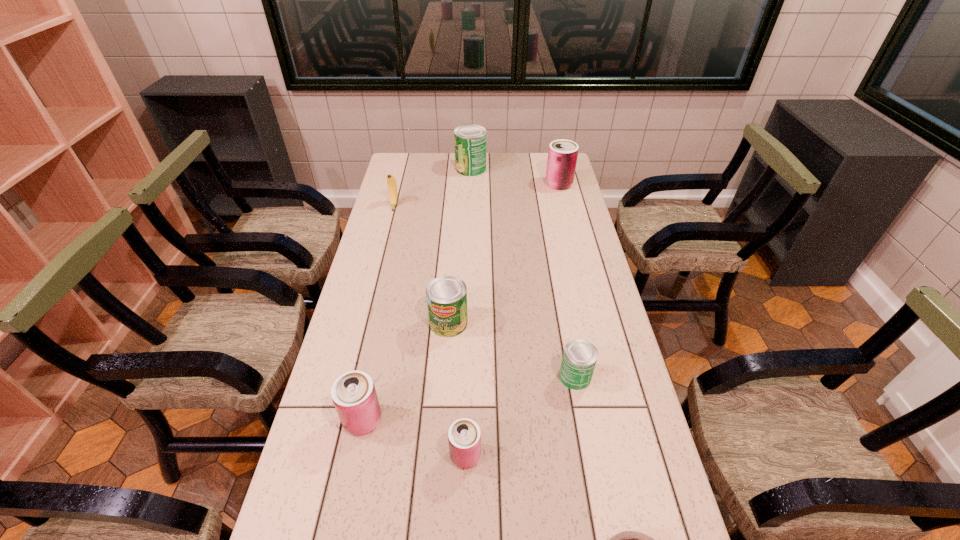
The height and width of the screenshot is (540, 960). In order to click on banana that is at the left edge in this screenshot , I will do `click(391, 181)`.

This screenshot has width=960, height=540. Identify the location of can located at the left edge. (353, 393).

The image size is (960, 540). Find the location of `object that is at the far right corner`. object that is at the far right corner is located at coordinates (562, 155).

Where is `blank area at the far edge`? This screenshot has height=540, width=960. blank area at the far edge is located at coordinates (525, 154).

Find the location of a particular element. This screenshot has height=540, width=960. free space at the left edge of the desktop is located at coordinates (399, 305).

In the image, there is a desktop. Where is `vacant space at the right edge`? This screenshot has width=960, height=540. vacant space at the right edge is located at coordinates (596, 302).

Identify the location of vacant area at the far left corner of the desktop. (423, 169).

Image resolution: width=960 pixels, height=540 pixels. I want to click on vacant space that is in between the nearest green can and the biggest green can, so click(523, 273).

Where is `free space between the fourth nearest object and the farthest pink can`? free space between the fourth nearest object and the farthest pink can is located at coordinates (567, 280).

At what (x,y) coordinates should I click in order to perform the action: click on vacant region between the second farthest green can and the seventh nearest object. Please return your answer as a coordinate pair (x, y). The width and height of the screenshot is (960, 540). Looking at the image, I should click on (504, 253).